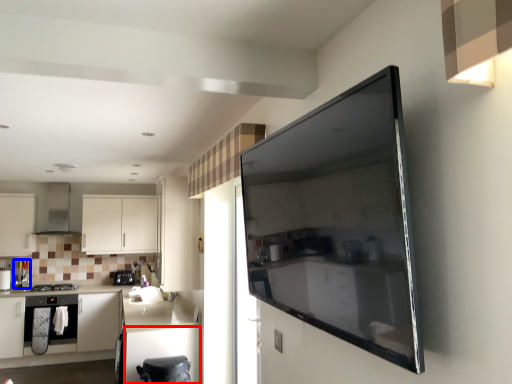
Question: Which point is closer to the camera, cabinetry (highlighted by a red box) or appliance (highlighted by a blue box)?

Choices:
 (A) cabinetry
 (B) appliance

Answer: (A)